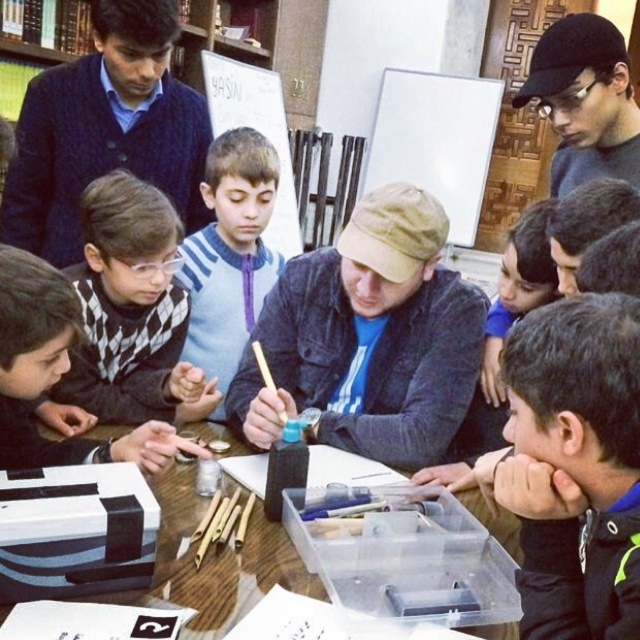
You are a photographer trying to capture a candid shot of the black matte cap at upper right without including the dark blue fleece at lower right in the frame. Based on their positions, is this possible?

The dark blue fleece at lower right is in front of the black matte cap at upper right, so it would block the view of the black matte cap at upper right. Therefore, capturing a clear shot of the black matte cap at upper right without the dark blue fleece at lower right in the frame is not possible.

You are an observer looking at the scene. You notice the dark blue fleece at lower right and the black matte cap at upper right. Which of these two items is smaller in size?

The dark blue fleece at lower right has a smaller size compared to the black matte cap at upper right, so the dark blue fleece at lower right is smaller.